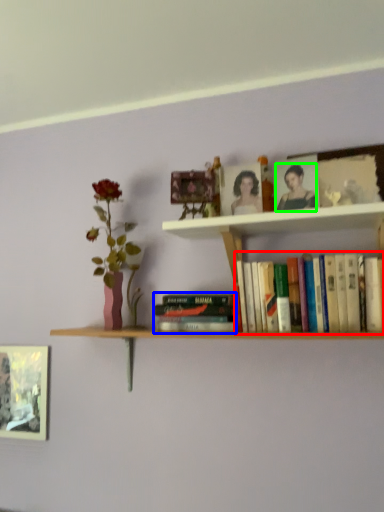
Question: Which object is the closest to the book (highlighted by a red box)? Choose among these: book (highlighted by a blue box) or person (highlighted by a green box).

Choices:
 (A) book
 (B) person

Answer: (A)